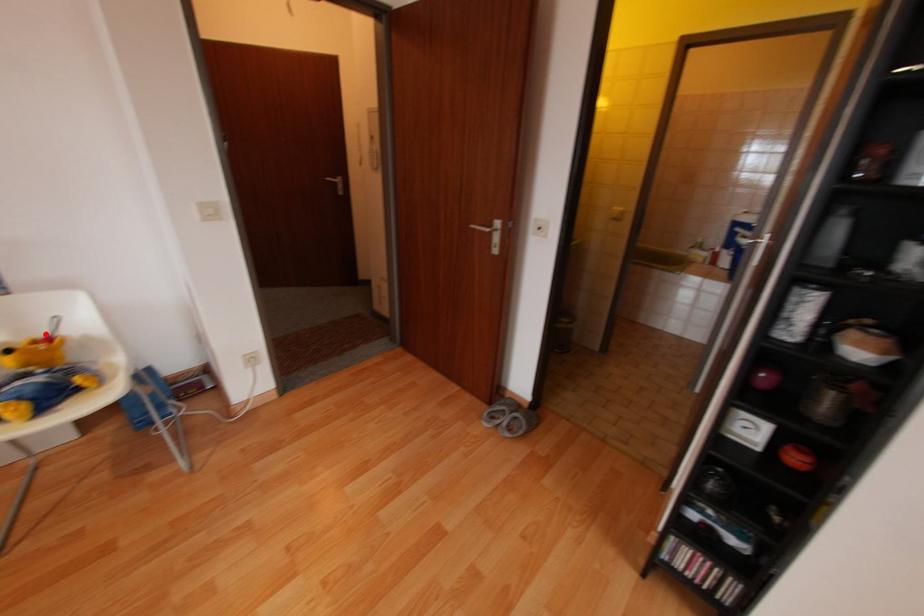
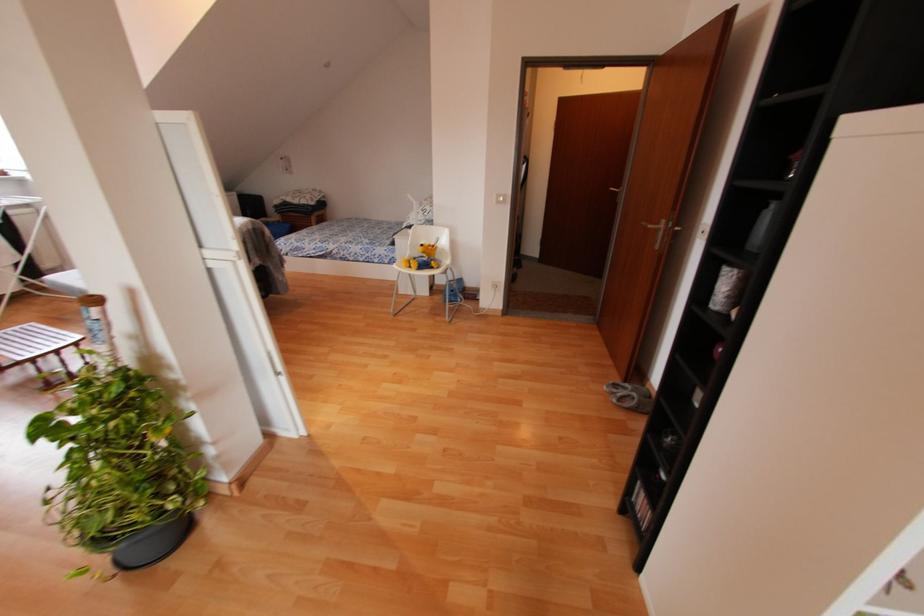
Question: A red point is marked in image1. In image2, is the corresponding 3D point closer to the camera or farther? Reply with the corresponding letter.

Choices:
 (A) The corresponding 3D point is closer.
 (B) The corresponding 3D point is farther.

Answer: (A)